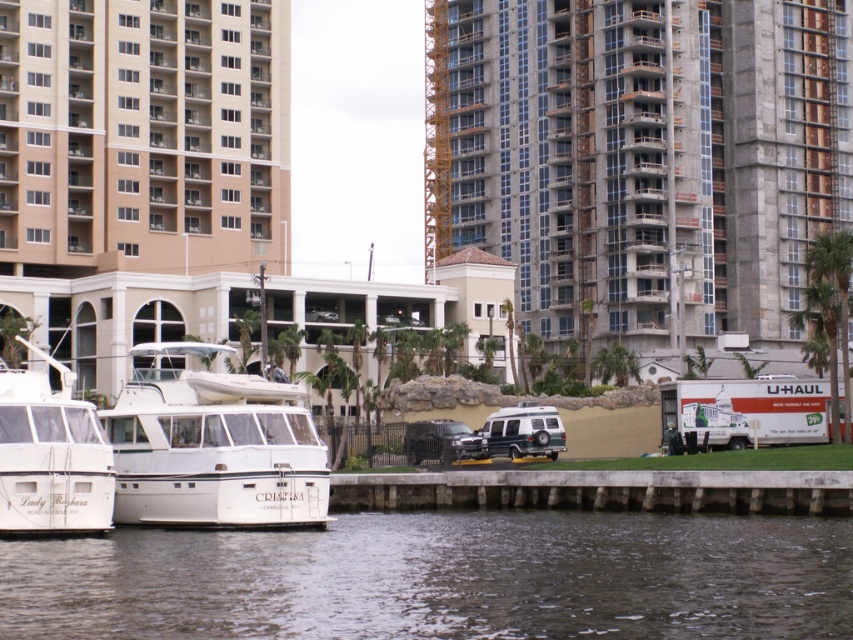
What do you see at coordinates (143, 134) in the screenshot?
I see `beige concrete building at upper left` at bounding box center [143, 134].

Can you confirm if beige concrete building at upper left is positioned to the left of white glossy boat at left?

Correct, you'll find beige concrete building at upper left to the left of white glossy boat at left.

Between point (70, 93) and point (96, 424), which one is positioned behind?

The point (70, 93) is behind.

Image resolution: width=853 pixels, height=640 pixels. In order to click on beige concrete building at upper left in this screenshot , I will do `click(143, 134)`.

Does point (151, 225) lie in front of point (416, 492)?

That is False.

Does beige concrete building at upper left come in front of concrete at lower center?

No, it is behind concrete at lower center.

What do you see at coordinates (143, 134) in the screenshot? I see `beige concrete building at upper left` at bounding box center [143, 134].

At what (x,y) coordinates should I click in order to perform the action: click on beige concrete building at upper left. Please return your answer as a coordinate pair (x, y). Looking at the image, I should click on (143, 134).

Does concrete building at center appear under white glossy boat at center?

No.

Is concrete building at center wider than white glossy boat at center?

Correct, the width of concrete building at center exceeds that of white glossy boat at center.

Does point (712, 42) lie behind point (228, 381)?

Yes.

The image size is (853, 640). I want to click on concrete building at center, so point(640,156).